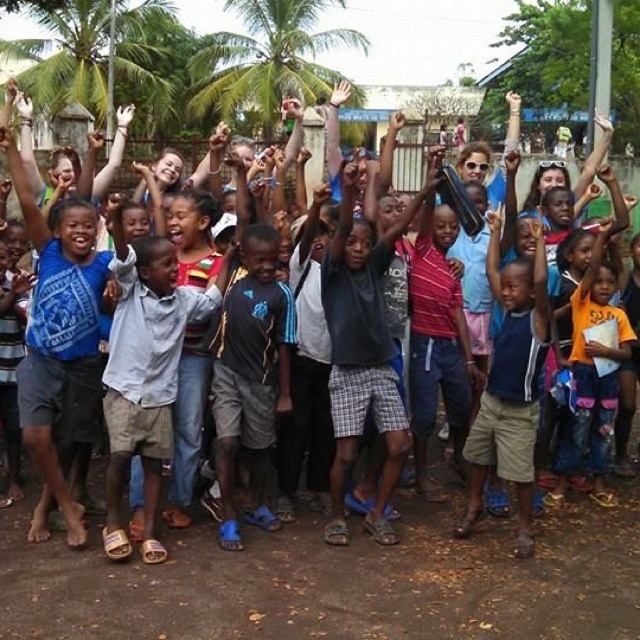
Who is taller, gray plaid shorts at center or dark gray shorts at center?

Standing taller between the two is gray plaid shorts at center.

Can you confirm if gray plaid shorts at center is positioned above dark gray shorts at center?

Yes, gray plaid shorts at center is above dark gray shorts at center.

The width and height of the screenshot is (640, 640). What do you see at coordinates (362, 355) in the screenshot?
I see `gray plaid shorts at center` at bounding box center [362, 355].

Find the location of a particular element. gray plaid shorts at center is located at coordinates (362, 355).

Is dark gray shorts at center behind green leafy palm tree at upper center?

No, it is in front of green leafy palm tree at upper center.

Does dark gray shorts at center have a larger size compared to green leafy palm tree at upper center?

No, dark gray shorts at center is not bigger than green leafy palm tree at upper center.

Between point (234, 378) and point (266, 124), which one is positioned behind?

Positioned behind is point (266, 124).

Identify the location of dark gray shorts at center. (252, 376).

Which of these two, dark blue cotton shirt at center or green leafy palm tree at upper center, stands shorter?

Standing shorter between the two is dark blue cotton shirt at center.

You are a GUI agent. You are given a task and a screenshot of the screen. Output one action in this format:
    pyautogui.click(x=<x>, y=<y>)
    Task: Click on the dark blue cotton shirt at center
    This screenshot has height=640, width=640.
    Given the screenshot: What is the action you would take?
    pyautogui.click(x=509, y=385)

This screenshot has height=640, width=640. I want to click on dark blue cotton shirt at center, so click(x=509, y=385).